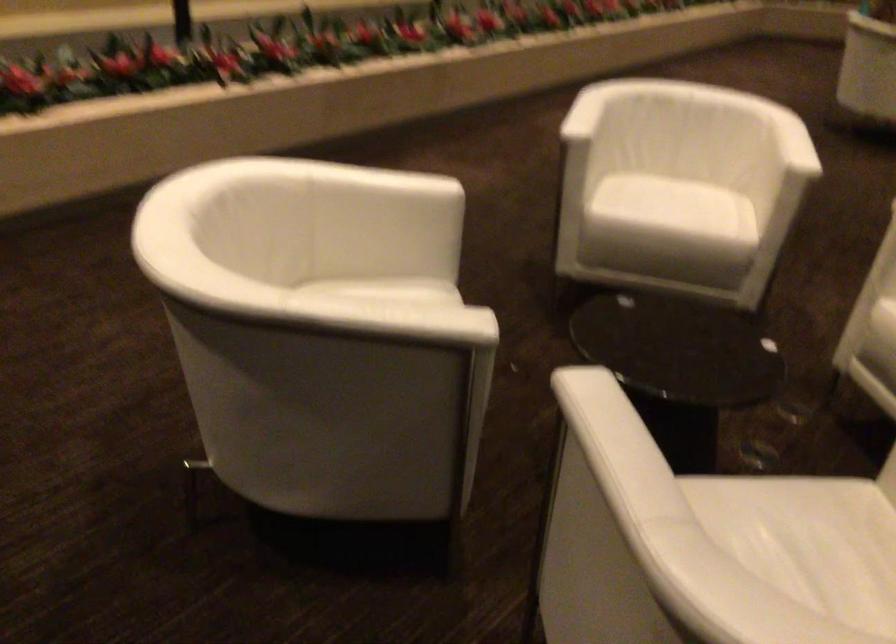
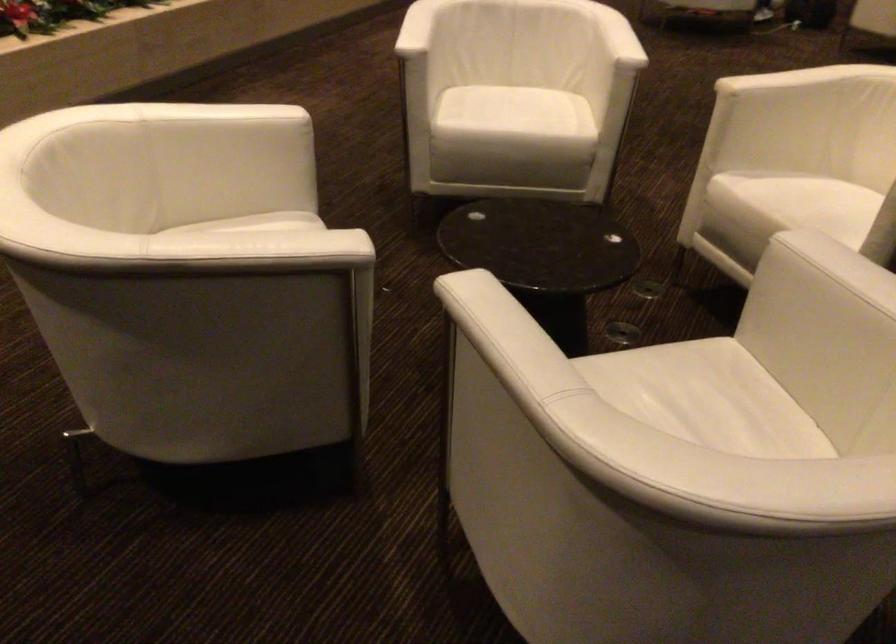
The point at (x=810, y=525) is marked in the first image. Where is the corresponding point in the second image?

(686, 388)